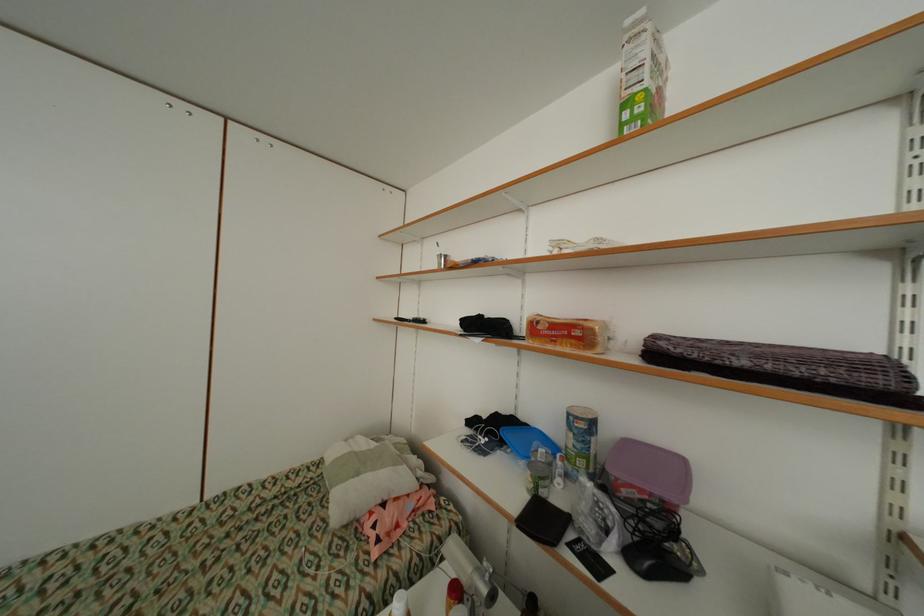
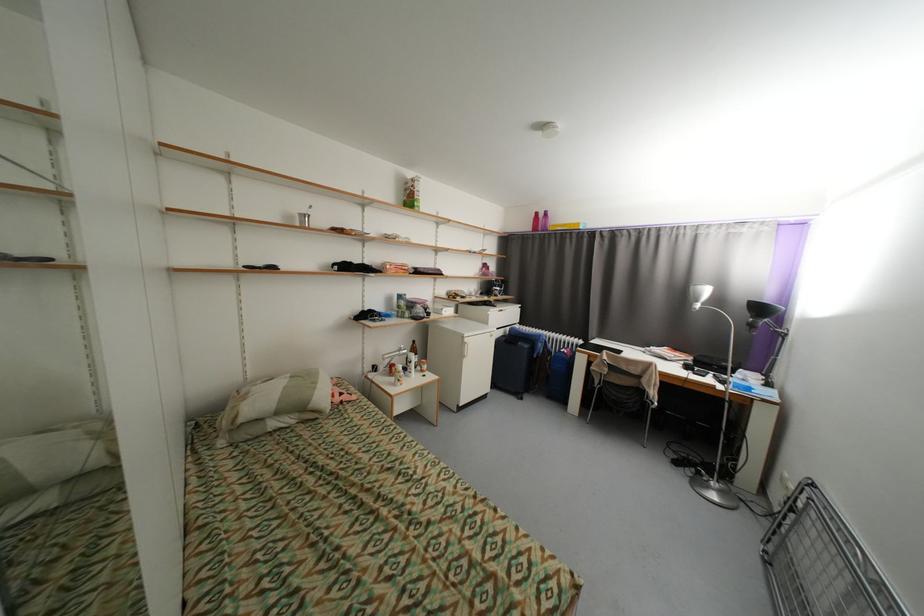
Locate, in the second image, the point that corresponds to pixel 363 475 in the first image.

(322, 384)